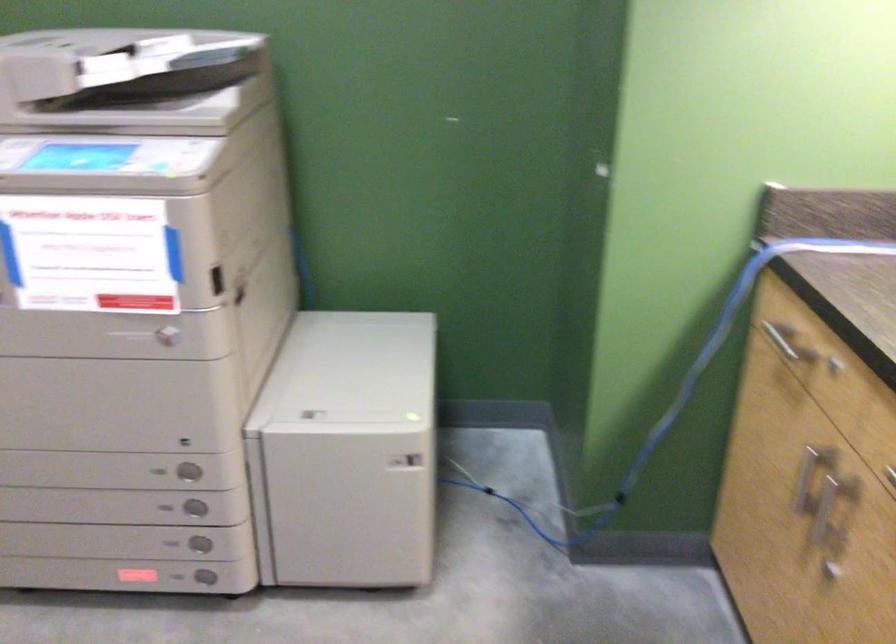
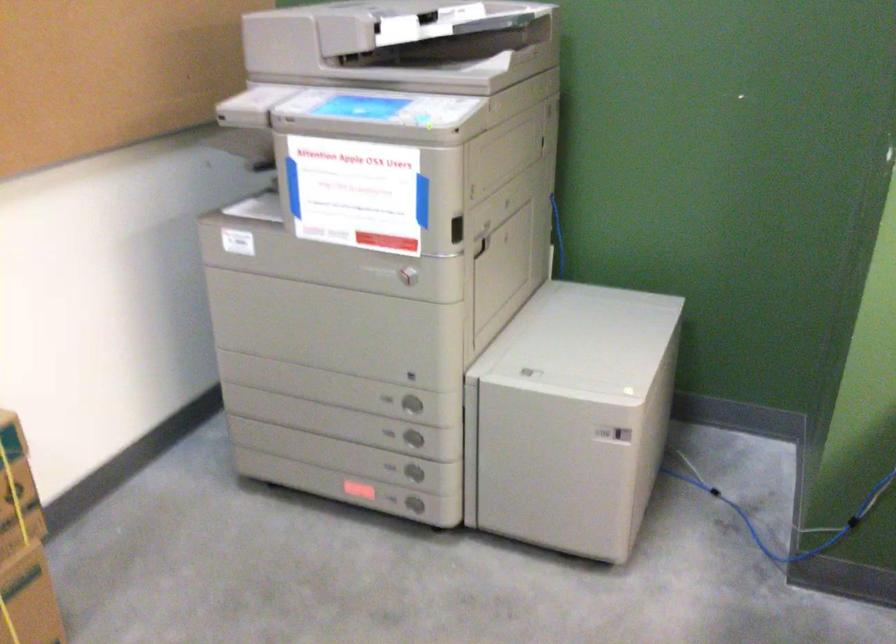
Question: How did the camera likely rotate?

Choices:
 (A) Left
 (B) Right
 (C) Up
 (D) Down

Answer: (A)